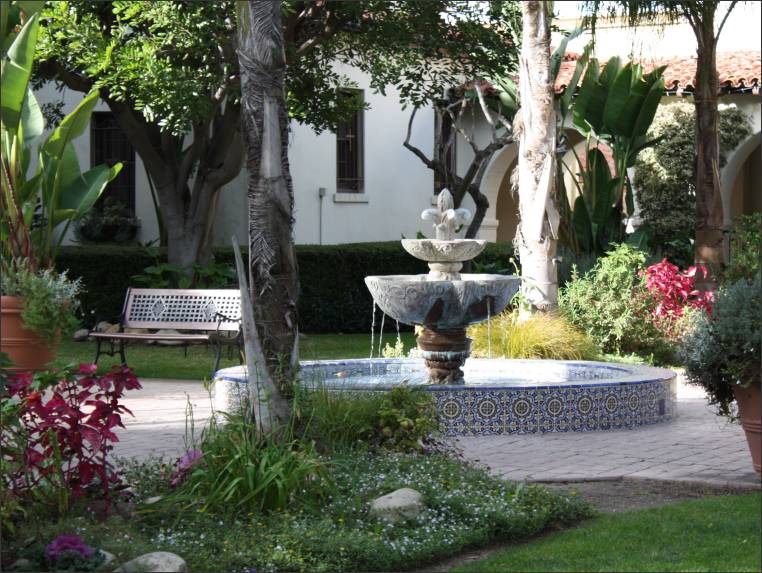
Find the location of a particular element. This screenshot has width=762, height=573. pot is located at coordinates (8, 331).